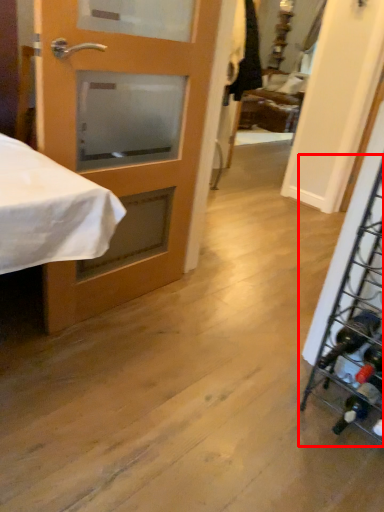
Question: From the image's perspective, where is wine rack (annotated by the red box) located relative to door?

Choices:
 (A) above
 (B) below

Answer: (B)